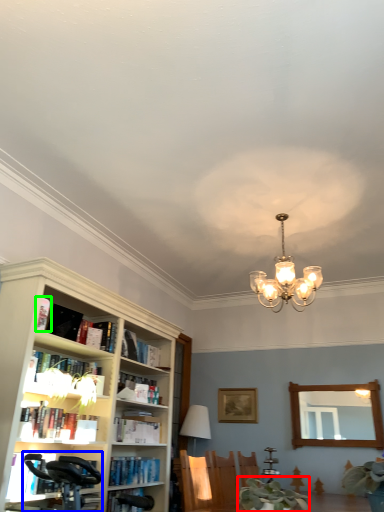
Question: Based on their relative distances, which object is nearer to plant (highlighted by a red box)? Choose from swivel chair (highlighted by a blue box) and book (highlighted by a green box).

Choices:
 (A) swivel chair
 (B) book

Answer: (A)